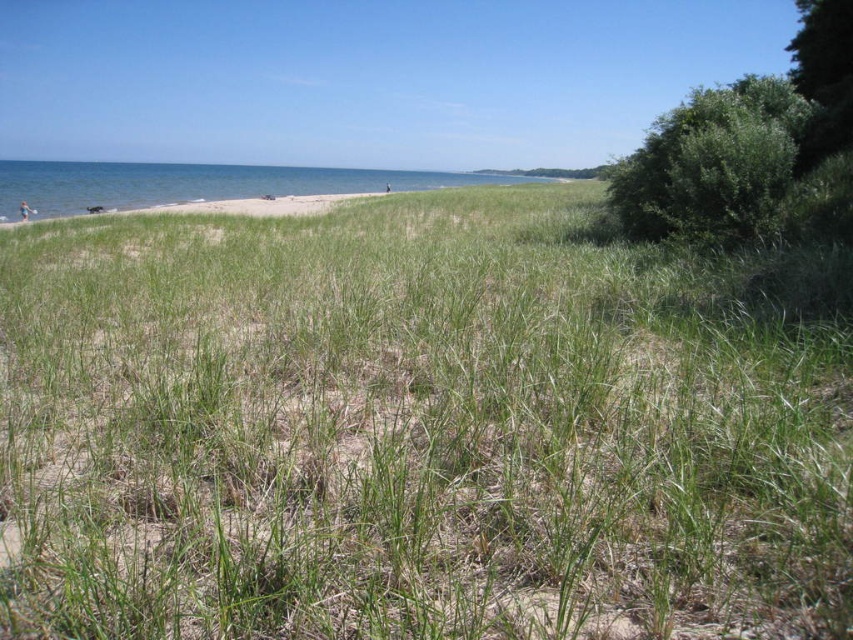
Question: Which point is farther to the camera?

Choices:
 (A) green grassy at center
 (B) blue water at upper left

Answer: (B)

Question: Is green grassy at center smaller than blue water at upper left?

Choices:
 (A) yes
 (B) no

Answer: (A)

Question: Can you confirm if green grassy at center is positioned to the right of blue water at upper left?

Choices:
 (A) yes
 (B) no

Answer: (A)

Question: Is green grassy at center bigger than blue water at upper left?

Choices:
 (A) no
 (B) yes

Answer: (A)

Question: Which object is farther from the camera taking this photo?

Choices:
 (A) green grassy at center
 (B) blue water at upper left

Answer: (B)

Question: Which point is closer to the camera?

Choices:
 (A) (605, 531)
 (B) (149, 166)

Answer: (A)